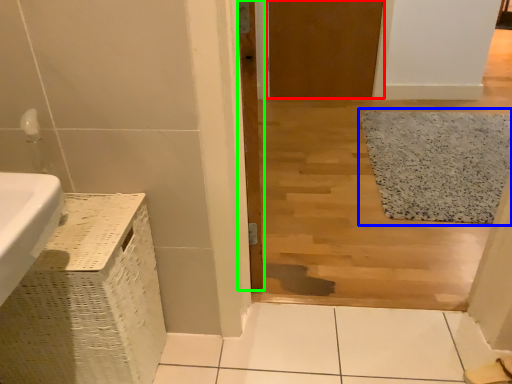
Question: Based on their relative distances, which object is nearer to door (highlighted by a red box)? Choose from bath mat (highlighted by a blue box) and door (highlighted by a green box).

Choices:
 (A) bath mat
 (B) door

Answer: (A)